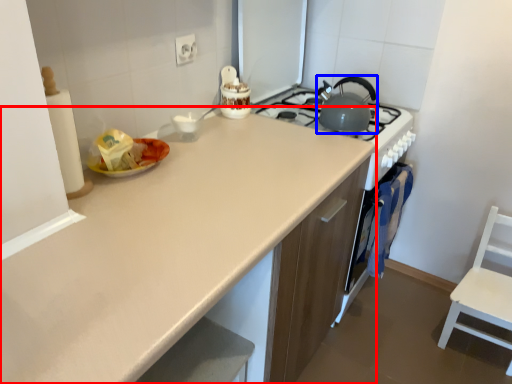
Question: Among these objects, which one is nearest to the camera, countertop (highlighted by a red box) or kitchen appliance (highlighted by a blue box)?

Choices:
 (A) countertop
 (B) kitchen appliance

Answer: (A)